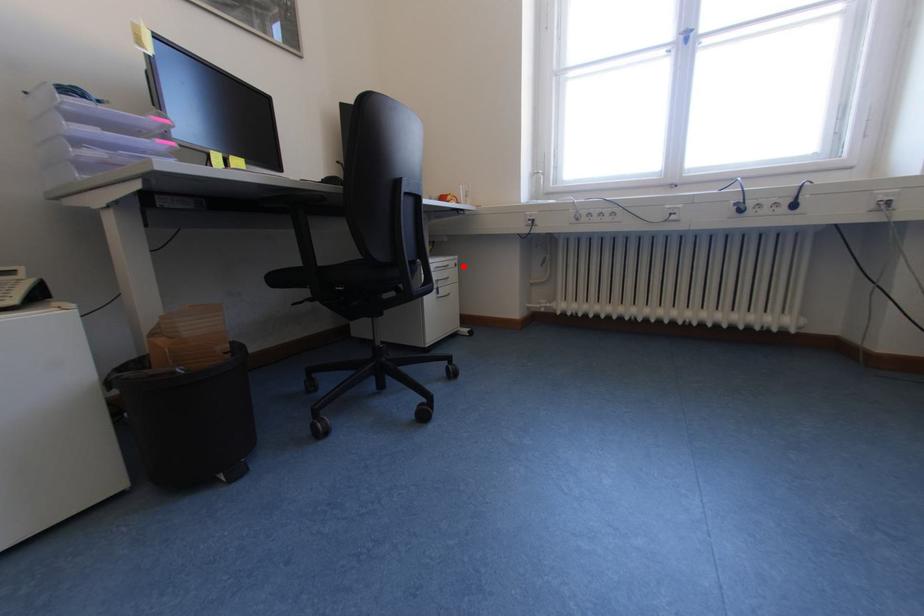
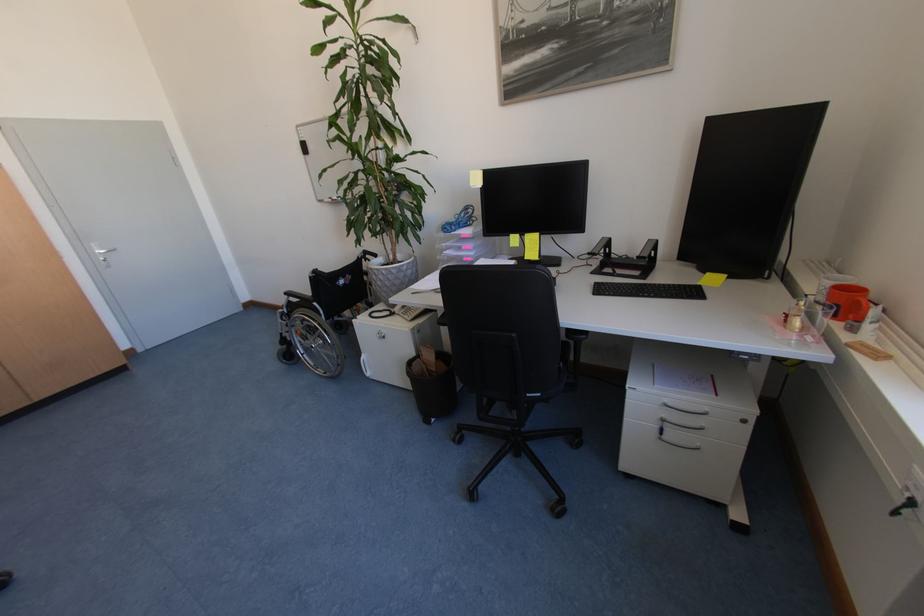
The point at the highlighted location is marked in the first image. Where is the corresponding point in the second image?

(751, 422)